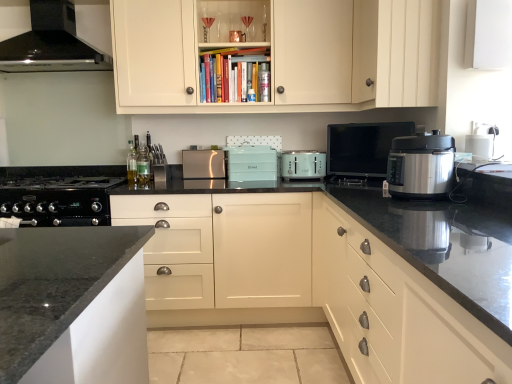
Question: Does satin silver toaster at center, which ranks as the fifth kitchen appliance in right-to-left order, have a lesser height compared to matte white cabinet at upper center, which is the 1th cabinetry in top-to-bottom order?

Choices:
 (A) yes
 (B) no

Answer: (A)

Question: From a real-world perspective, is satin silver toaster at center, which ranks as the fifth kitchen appliance in right-to-left order, beneath matte white cabinet at upper center, which is the 1th cabinetry in top-to-bottom order?

Choices:
 (A) no
 (B) yes

Answer: (B)

Question: Is satin silver toaster at center, the 1th kitchen appliance in the left-to-right sequence, at the left side of matte white cabinet at upper center, marked as the 5th cabinetry in a bottom-to-top arrangement?

Choices:
 (A) yes
 (B) no

Answer: (A)

Question: From the image's perspective, is satin silver toaster at center, the 1th kitchen appliance in the left-to-right sequence, below matte white cabinet at upper center, which is the 1th cabinetry in top-to-bottom order?

Choices:
 (A) no
 (B) yes

Answer: (B)

Question: Does satin silver toaster at center, the 1th kitchen appliance in the left-to-right sequence, have a smaller size compared to matte white cabinet at upper center, which is the 1th cabinetry in top-to-bottom order?

Choices:
 (A) yes
 (B) no

Answer: (A)

Question: Is black glossy range hood at upper left, positioned as the first home appliance in top-to-bottom order, spatially inside matte white cabinet at upper center, marked as the 5th cabinetry in a bottom-to-top arrangement, or outside of it?

Choices:
 (A) outside
 (B) inside

Answer: (B)

Question: Relative to matte white cabinet at upper center, marked as the 5th cabinetry in a bottom-to-top arrangement, is black glossy range hood at upper left, marked as the 2th home appliance in a bottom-to-top arrangement, in front or behind?

Choices:
 (A) front
 (B) behind

Answer: (B)

Question: From the image's perspective, is black glossy range hood at upper left, positioned as the first home appliance in top-to-bottom order, above or below matte white cabinet at upper center, marked as the 5th cabinetry in a bottom-to-top arrangement?

Choices:
 (A) below
 (B) above

Answer: (B)

Question: Is black glossy range hood at upper left, positioned as the first home appliance in top-to-bottom order, wider or thinner than matte white cabinet at upper center, marked as the 5th cabinetry in a bottom-to-top arrangement?

Choices:
 (A) thin
 (B) wide

Answer: (A)

Question: Is point (389, 337) closer or farther from the camera than point (76, 61)?

Choices:
 (A) farther
 (B) closer

Answer: (B)

Question: Based on their sizes in the image, would you say matte white drawers at right, the second cabinetry in the bottom-to-top sequence, is bigger or smaller than black glossy range hood at upper left, positioned as the first home appliance in top-to-bottom order?

Choices:
 (A) small
 (B) big

Answer: (B)

Question: Is matte white drawers at right, the second cabinetry in the bottom-to-top sequence, wider or thinner than black glossy range hood at upper left, marked as the 2th home appliance in a bottom-to-top arrangement?

Choices:
 (A) thin
 (B) wide

Answer: (B)

Question: Based on their positions, is matte white drawers at right, the second cabinetry in the bottom-to-top sequence, located to the left or right of black glossy range hood at upper left, positioned as the first home appliance in top-to-bottom order?

Choices:
 (A) left
 (B) right

Answer: (B)

Question: In terms of size, does clear glass bottle at center, which is the 2th bottle from right to left, appear bigger or smaller than satin silver toaster at center, marked as the first kitchen appliance in a back-to-front arrangement?

Choices:
 (A) small
 (B) big

Answer: (A)

Question: Considering the positions of point (129, 140) and point (185, 167), is point (129, 140) closer or farther from the camera than point (185, 167)?

Choices:
 (A) closer
 (B) farther

Answer: (B)